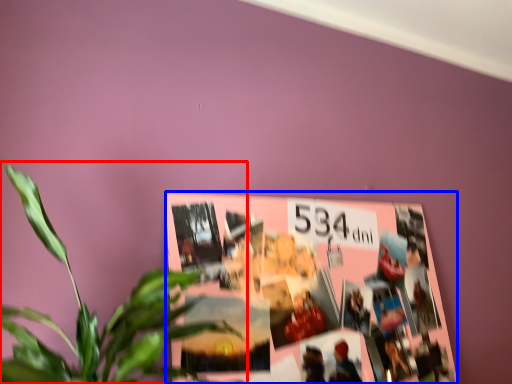
Question: Which of the following is the closest to the observer, houseplant (highlighted by a red box) or bulletin board (highlighted by a blue box)?

Choices:
 (A) houseplant
 (B) bulletin board

Answer: (A)